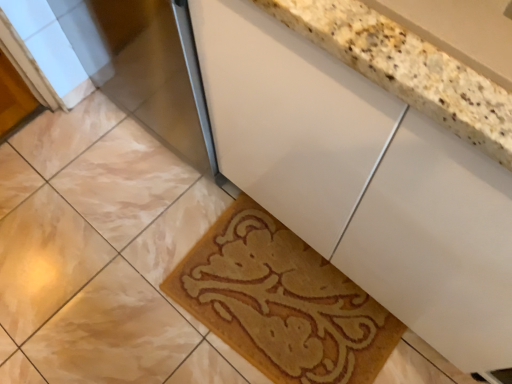
At what (x,y) coordinates should I click in order to perform the action: click on vacant space that is in between beige textured bath mat at lower center and marble tile at lower left. Please return your answer as a coordinate pair (x, y). This screenshot has width=512, height=384. Looking at the image, I should click on (147, 274).